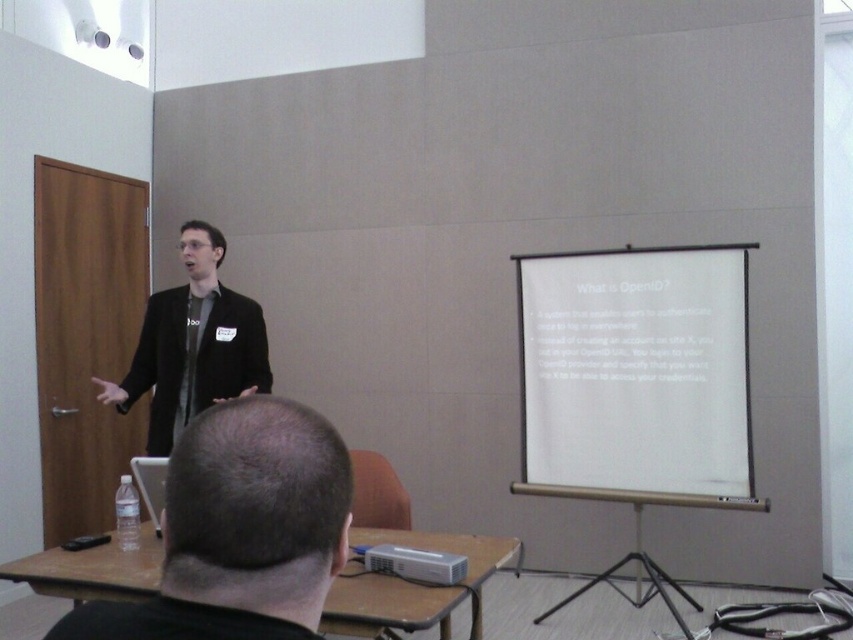
From the picture: Can you confirm if black hair at upper center is wider than silver metallic projector at lower center?

Correct, the width of black hair at upper center exceeds that of silver metallic projector at lower center.

Between black hair at upper center and silver metallic projector at lower center, which one appears on the right side from the viewer's perspective?

silver metallic projector at lower center is more to the right.

Where is `black hair at upper center`? The image size is (853, 640). black hair at upper center is located at coordinates (241, 531).

Is point (646, 406) closer to viewer compared to point (305, 605)?

No, (646, 406) is further to viewer.

Can you confirm if white matte projection screen at center right is positioned to the left of black hair at upper center?

Incorrect, white matte projection screen at center right is not on the left side of black hair at upper center.

Describe the element at coordinates (636, 371) in the screenshot. I see `white matte projection screen at center right` at that location.

I want to click on white matte projection screen at center right, so click(636, 371).

Does white matte projection screen at center right appear under silver metallic projector at lower center?

Incorrect, white matte projection screen at center right is not positioned below silver metallic projector at lower center.

What do you see at coordinates (636, 371) in the screenshot? This screenshot has width=853, height=640. I see `white matte projection screen at center right` at bounding box center [636, 371].

Does point (727, 252) come in front of point (367, 557)?

That is False.

At what (x,y) coordinates should I click in order to perform the action: click on white matte projection screen at center right. Please return your answer as a coordinate pair (x, y). Looking at the image, I should click on [636, 371].